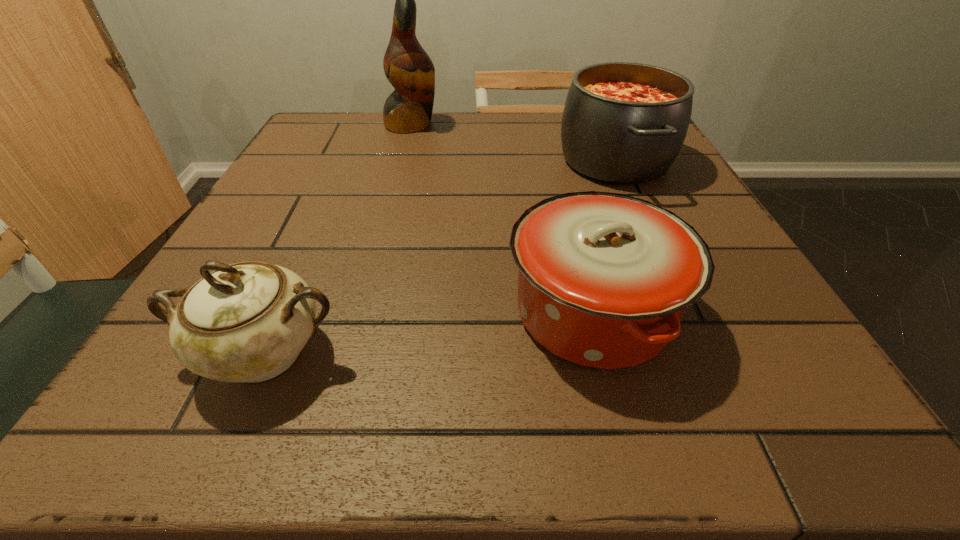
This screenshot has width=960, height=540. Find the location of `vacant space at the near right corner of the desktop`. vacant space at the near right corner of the desktop is located at coordinates (824, 421).

I want to click on unoccupied position between the parrot and the farther casserole, so click(513, 143).

I want to click on vacant point located between the nearer casserole and the chinaware, so click(x=428, y=333).

Where is `free space between the chinaware and the nearer casserole`? free space between the chinaware and the nearer casserole is located at coordinates (428, 333).

Where is `vacant area that lies between the farther casserole and the chinaware`? vacant area that lies between the farther casserole and the chinaware is located at coordinates (440, 257).

This screenshot has height=540, width=960. Find the location of `free space between the chinaware and the farther casserole`. free space between the chinaware and the farther casserole is located at coordinates (440, 257).

The height and width of the screenshot is (540, 960). I want to click on vacant area that lies between the farther casserole and the tallest object, so click(x=513, y=143).

Identify the location of free space between the chinaware and the tallest object. Image resolution: width=960 pixels, height=540 pixels. (338, 239).

Image resolution: width=960 pixels, height=540 pixels. I want to click on free spot between the tallest object and the chinaware, so click(x=338, y=239).

The height and width of the screenshot is (540, 960). I want to click on free spot between the chinaware and the nearer casserole, so click(x=428, y=333).